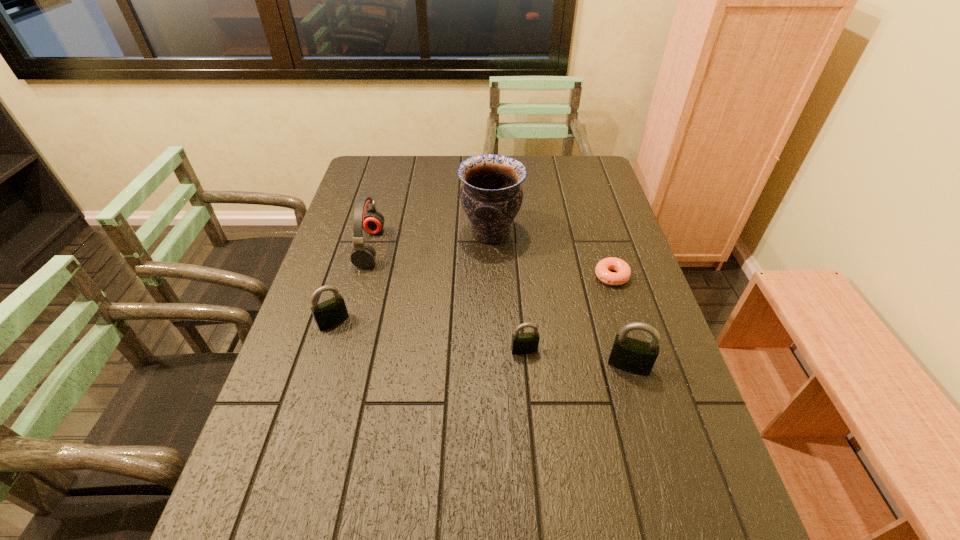
Locate an element on the screen. This screenshot has width=960, height=540. vacant area situated 0.310m on the right of the second nearest object is located at coordinates (665, 350).

I want to click on vacant area situated on the back of the tallest padlock, so click(x=604, y=280).

The width and height of the screenshot is (960, 540). In order to click on free space located on the front of the doughnut in this screenshot , I will do `click(623, 313)`.

Image resolution: width=960 pixels, height=540 pixels. What are the coordinates of `vacant region located 0.100m on the front handle of the pottery` in the screenshot? It's located at (428, 233).

The width and height of the screenshot is (960, 540). Identify the location of free point located on the front handle of the pottery. (362, 233).

Find the location of `blank space located on the front handle of the pottery`. blank space located on the front handle of the pottery is located at coordinates (394, 233).

You are a GUI agent. You are given a task and a screenshot of the screen. Output one action in this format:
    pyautogui.click(x=<x>, y=<y>)
    Task: Click on the vacant space located on the ear cups of the earphone
    The height and width of the screenshot is (540, 960).
    Given the screenshot: What is the action you would take?
    pyautogui.click(x=509, y=247)

Locate an element on the screen. The image size is (960, 540). padlock located in the left edge section of the desktop is located at coordinates (333, 311).

In order to click on earphone positioned at the left edge in this screenshot , I will do `click(363, 255)`.

Find the location of a particular element. The height and width of the screenshot is (540, 960). padlock present at the right edge is located at coordinates click(x=628, y=354).